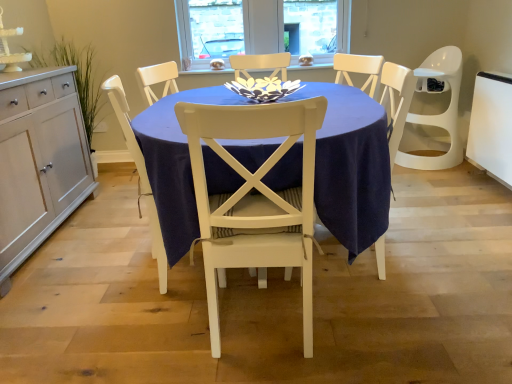
Question: Does navy blue fabric table at center appear on the right side of white wood chair at center, acting as the first chair starting from the left?

Choices:
 (A) no
 (B) yes

Answer: (B)

Question: Considering the relative sizes of navy blue fabric table at center and white wood chair at center, acting as the first chair starting from the left, in the image provided, is navy blue fabric table at center smaller than white wood chair at center, acting as the first chair starting from the left,?

Choices:
 (A) yes
 (B) no

Answer: (B)

Question: Is navy blue fabric table at center thinner than white wood chair at center, acting as the first chair starting from the left?

Choices:
 (A) yes
 (B) no

Answer: (B)

Question: Would you say navy blue fabric table at center is outside white wood chair at center, positioned as the second chair in right-to-left order?

Choices:
 (A) no
 (B) yes

Answer: (B)

Question: Considering the relative sizes of navy blue fabric table at center and white wood chair at center, acting as the first chair starting from the left, in the image provided, is navy blue fabric table at center taller than white wood chair at center, acting as the first chair starting from the left,?

Choices:
 (A) no
 (B) yes

Answer: (A)

Question: Is navy blue fabric table at center inside the boundaries of white wood cabinet at left, or outside?

Choices:
 (A) outside
 (B) inside

Answer: (A)

Question: Considering the relative positions of navy blue fabric table at center and white wood cabinet at left in the image provided, is navy blue fabric table at center to the left or to the right of white wood cabinet at left?

Choices:
 (A) left
 (B) right

Answer: (B)

Question: Is navy blue fabric table at center in front of or behind white wood cabinet at left in the image?

Choices:
 (A) front
 (B) behind

Answer: (A)

Question: From the image's perspective, relative to white wood cabinet at left, is navy blue fabric table at center above or below?

Choices:
 (A) above
 (B) below

Answer: (B)

Question: Is white wood cabinet at left wider or thinner than white painted wood chair at center, which is counted as the 2th chair, starting from the left?

Choices:
 (A) thin
 (B) wide

Answer: (A)

Question: In the image, is white wood cabinet at left positioned in front of or behind white painted wood chair at center, which is counted as the 2th chair, starting from the left?

Choices:
 (A) front
 (B) behind

Answer: (B)

Question: Would you say white wood cabinet at left is inside or outside white painted wood chair at center, which is counted as the 2th chair, starting from the left?

Choices:
 (A) outside
 (B) inside

Answer: (A)

Question: Is point (27, 87) positioned closer to the camera than point (240, 107)?

Choices:
 (A) farther
 (B) closer

Answer: (A)

Question: From a real-world perspective, is white painted wood chair at center, the first chair positioned from the right, physically located above or below navy blue fabric table at center?

Choices:
 (A) below
 (B) above

Answer: (B)

Question: Relative to navy blue fabric table at center, is white painted wood chair at center, the first chair positioned from the right, in front or behind?

Choices:
 (A) front
 (B) behind

Answer: (A)